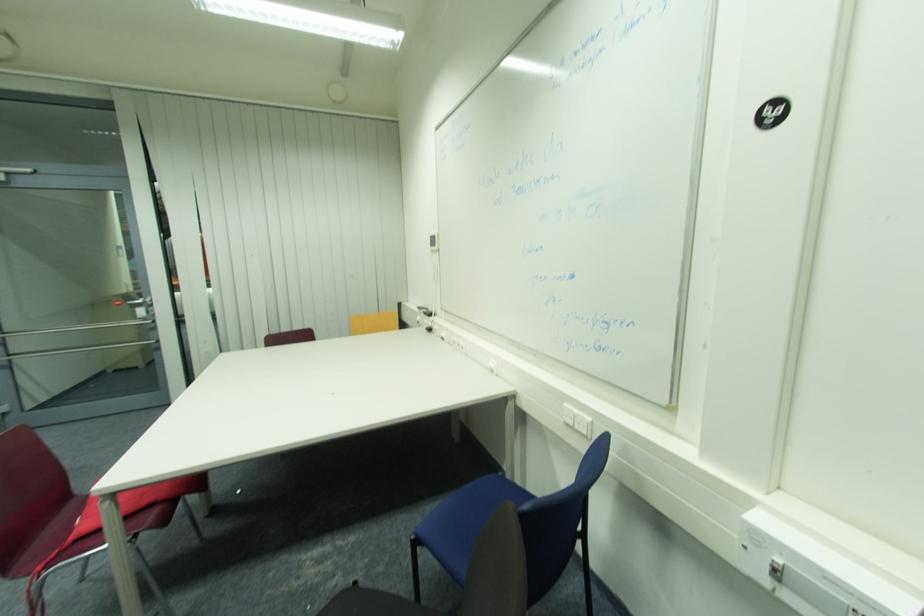
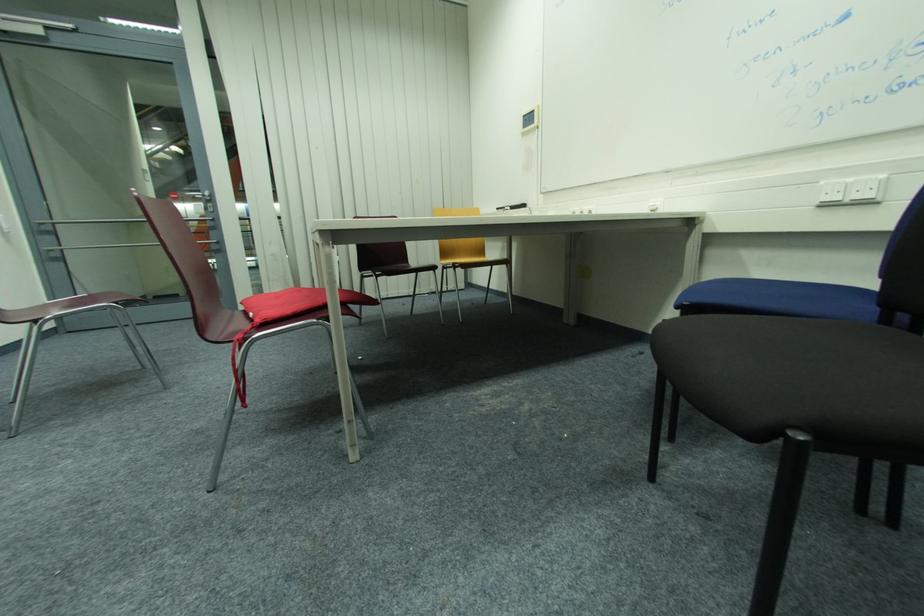
Question: Which direction would the cameraman need to move to produce the second image? Reply with the corresponding letter.

Choices:
 (A) Left
 (B) Right
 (C) Forward
 (D) Backward

Answer: (A)